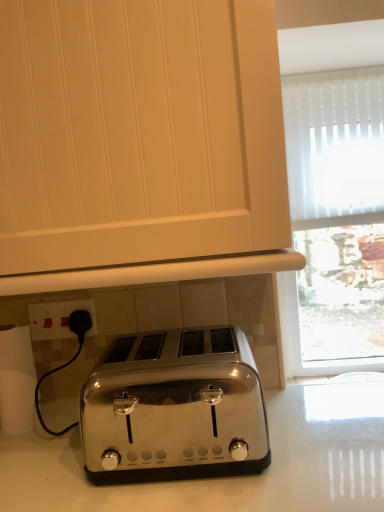
Question: Is satin chrome toaster at lower center thinner than white paper towel at lower left?

Choices:
 (A) no
 (B) yes

Answer: (A)

Question: Does satin chrome toaster at lower center lie behind white paper towel at lower left?

Choices:
 (A) no
 (B) yes

Answer: (A)

Question: Is satin chrome toaster at lower center shorter than white paper towel at lower left?

Choices:
 (A) yes
 (B) no

Answer: (B)

Question: Is satin chrome toaster at lower center turned away from white paper towel at lower left?

Choices:
 (A) yes
 (B) no

Answer: (B)

Question: From the image's perspective, is satin chrome toaster at lower center on white paper towel at lower left?

Choices:
 (A) yes
 (B) no

Answer: (A)

Question: Relative to satin chrome toaster at center, is white plastic switch at lower left in front or behind?

Choices:
 (A) front
 (B) behind

Answer: (B)

Question: Is white plastic switch at lower left to the left or to the right of satin chrome toaster at center in the image?

Choices:
 (A) left
 (B) right

Answer: (A)

Question: Is white plastic switch at lower left taller or shorter than satin chrome toaster at center?

Choices:
 (A) short
 (B) tall

Answer: (A)

Question: From the image's perspective, relative to satin chrome toaster at center, is white plastic switch at lower left above or below?

Choices:
 (A) below
 (B) above

Answer: (B)

Question: Is satin chrome toaster at center to the left or to the right of satin chrome toaster at lower center in the image?

Choices:
 (A) right
 (B) left

Answer: (A)

Question: Considering their positions, is satin chrome toaster at center located in front of or behind satin chrome toaster at lower center?

Choices:
 (A) behind
 (B) front

Answer: (A)

Question: From the image's perspective, is satin chrome toaster at center located above or below satin chrome toaster at lower center?

Choices:
 (A) above
 (B) below

Answer: (B)

Question: Considering the positions of satin chrome toaster at center and satin chrome toaster at lower center in the image, is satin chrome toaster at center wider or thinner than satin chrome toaster at lower center?

Choices:
 (A) thin
 (B) wide

Answer: (A)

Question: From a real-world perspective, relative to white plastic switch at lower left, is white paper towel at lower left vertically above or below?

Choices:
 (A) below
 (B) above

Answer: (A)

Question: In terms of size, does white paper towel at lower left appear bigger or smaller than white plastic switch at lower left?

Choices:
 (A) big
 (B) small

Answer: (A)